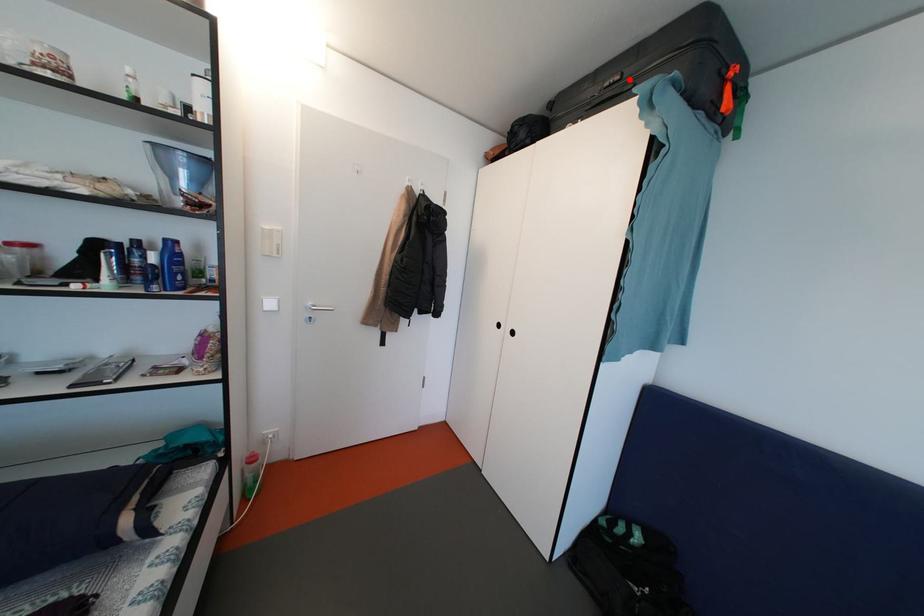
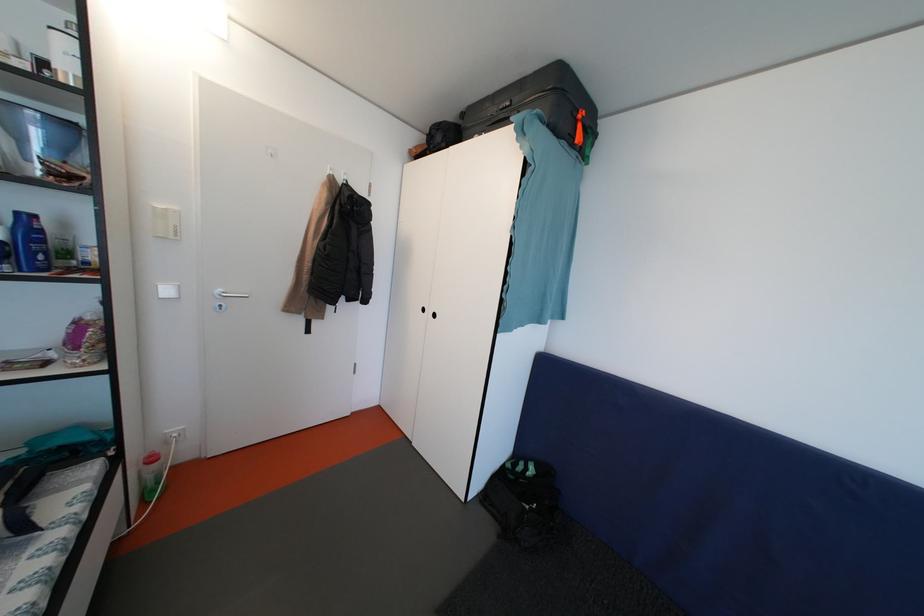
Question: I am providing you with two images of the same scene from different viewpoints. Image1 has a red point marked. In image2, the corresponding 3D location appears at what relative position? Reply with the corresponding letter.

Choices:
 (A) Closer
 (B) Farther

Answer: (A)